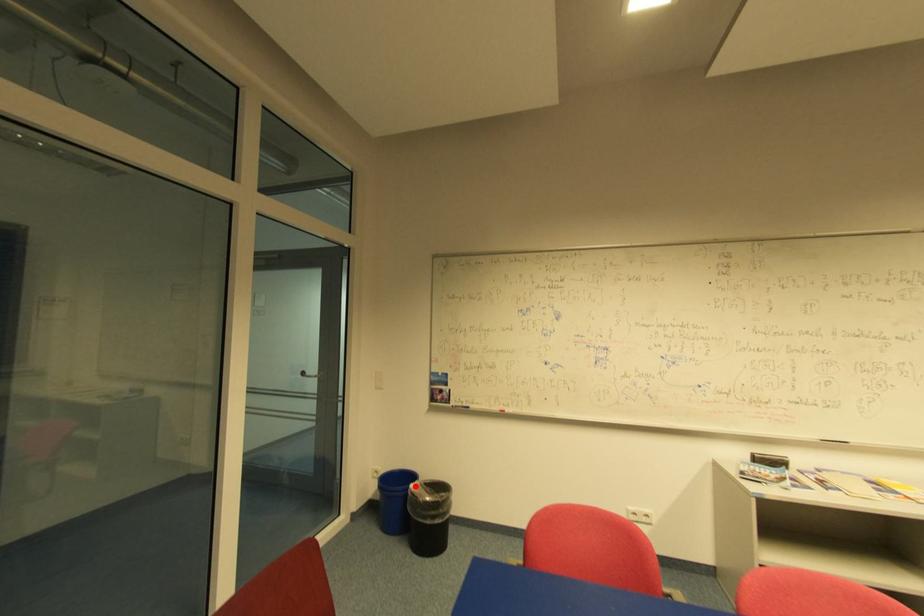
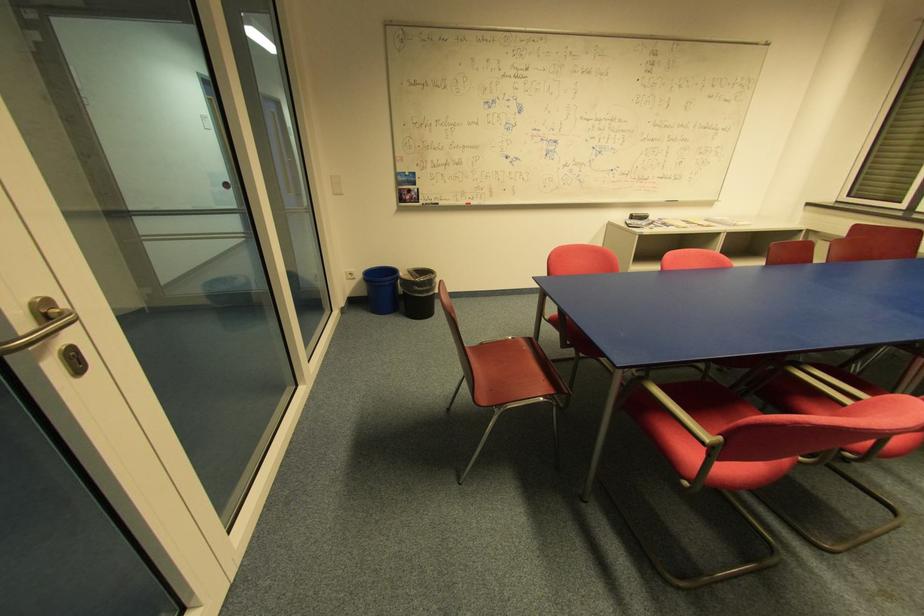
The point at the highlighted location is marked in the first image. Where is the corresponding point in the second image?

(405, 275)